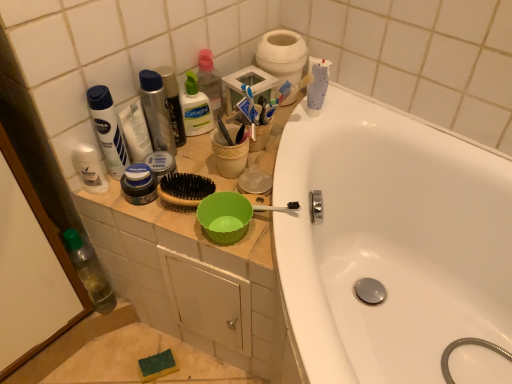
Image resolution: width=512 pixels, height=384 pixels. What are the coordinates of `spots to the right of white matte deodorant at upper left, the 1th toiletry viewed from the left` in the screenshot? It's located at coord(176,203).